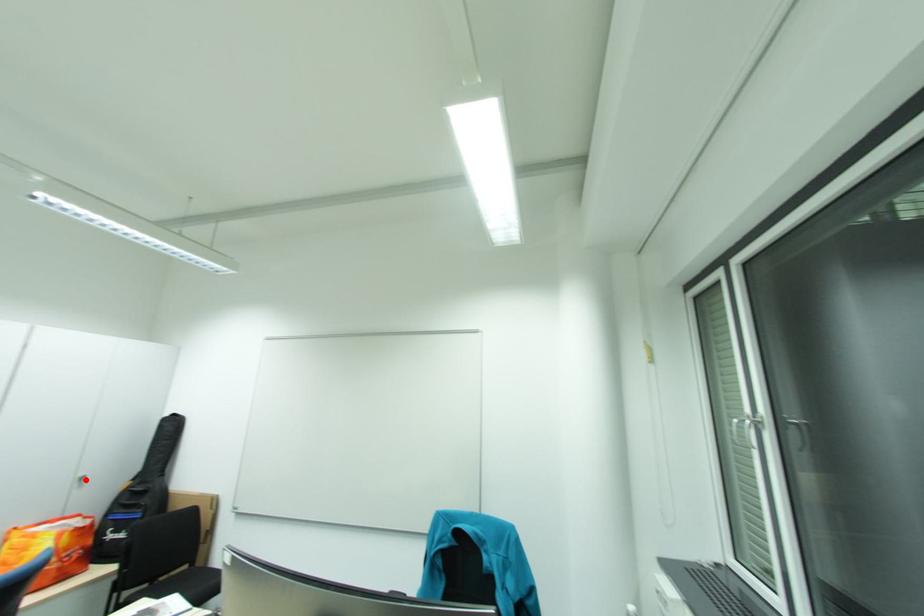
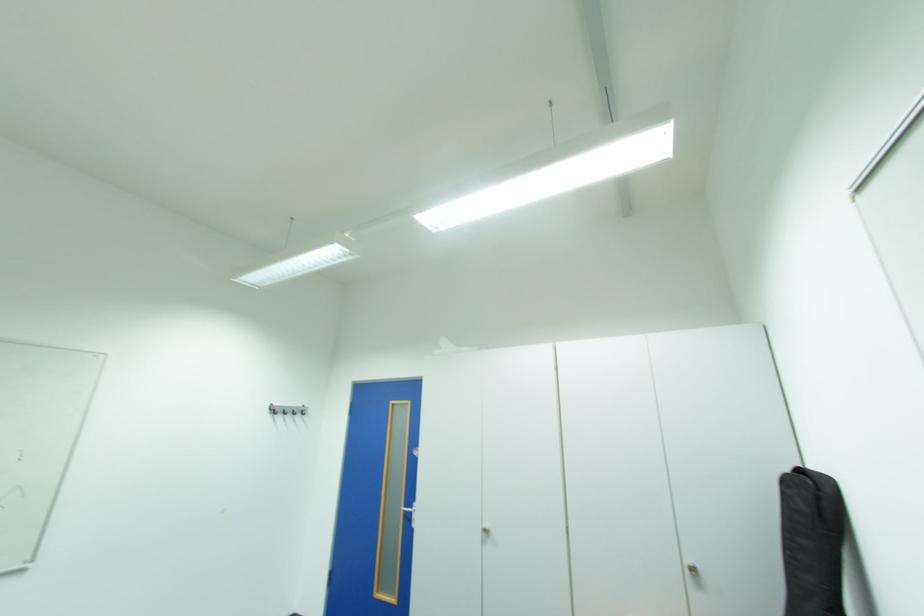
Question: A red point is marked in image1. In image2, is the corresponding 3D point closer to the camera or farther? Reply with the corresponding letter.

Choices:
 (A) The corresponding 3D point is closer.
 (B) The corresponding 3D point is farther.

Answer: (B)